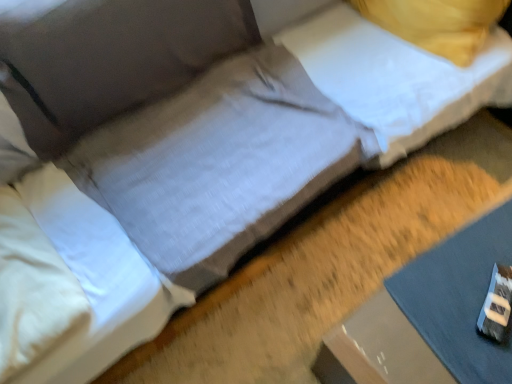
Question: Considering the positions of white soft pillow at upper right, which is counted as the 2th pillow, starting from the bottom, and gray fabric sheet at lower right in the image, is white soft pillow at upper right, which is counted as the 2th pillow, starting from the bottom, wider or thinner than gray fabric sheet at lower right?

Choices:
 (A) wide
 (B) thin

Answer: (B)

Question: In terms of height, does white soft pillow at upper right, which is the 2th pillow in front-to-back order, look taller or shorter compared to gray fabric sheet at lower right?

Choices:
 (A) tall
 (B) short

Answer: (A)

Question: Which of these objects is positioned closest to the gray fabric sheet at lower right?

Choices:
 (A) white soft pillow at upper right, the first pillow in the top-to-bottom sequence
 (B) white soft pillow at left, the first pillow in the bottom-to-top sequence

Answer: (A)

Question: Estimate the real-world distances between objects in this image. Which object is farther from the white soft pillow at left, the first pillow in the bottom-to-top sequence?

Choices:
 (A) white soft pillow at upper right, which is counted as the 1th pillow, starting from the back
 (B) gray fabric sheet at lower right

Answer: (A)